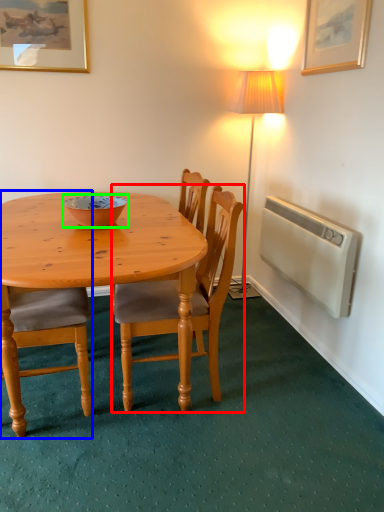
Question: Estimate the real-world distances between objects in this image. Which object is farther from chair (highlighted by a red box), chair (highlighted by a blue box) or bowl (highlighted by a green box)?

Choices:
 (A) chair
 (B) bowl

Answer: (B)